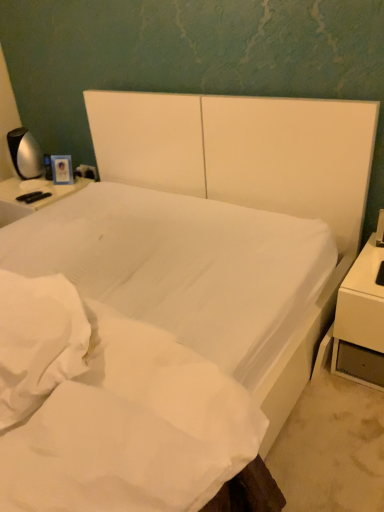
What do you see at coordinates (361, 319) in the screenshot?
I see `white glossy nightstand at right` at bounding box center [361, 319].

The height and width of the screenshot is (512, 384). I want to click on white smooth mattress at center, so click(x=110, y=408).

Where is `nightstand located behind the white smooth mattress at center`? nightstand located behind the white smooth mattress at center is located at coordinates (361, 319).

Consider the image. Looking at their sizes, would you say white glossy nightstand at right is wider or thinner than white smooth mattress at center?

In the image, white glossy nightstand at right appears to be more narrow than white smooth mattress at center.

Considering the positions of point (340, 315) and point (42, 374), is point (340, 315) closer or farther from the camera than point (42, 374)?

Point (340, 315) is positioned farther from the camera compared to point (42, 374).

From a real-world perspective, which is physically above, white glossy nightstand at right or white smooth mattress at center?

white smooth mattress at center.

Does white smooth mattress at center have a larger size compared to white glossy nightstand at right?

Indeed, white smooth mattress at center has a larger size compared to white glossy nightstand at right.

From the picture: Can white glossy nightstand at right be found inside white smooth mattress at center?

Definitely not — white glossy nightstand at right is not inside white smooth mattress at center.

From the image's perspective, which object appears higher, white smooth mattress at center or white glossy nightstand at right?

white glossy nightstand at right appears higher in the image.

Locate an element on the screen. Image resolution: width=384 pixels, height=512 pixels. mattress in front of the white glossy nightstand at right is located at coordinates (110, 408).

Based on the photo, is satin silver lamp at left turned away from white glossy nightstand at right?

That's not correct — satin silver lamp at left is not looking away from white glossy nightstand at right.

From the image's perspective, is satin silver lamp at left located beneath white glossy nightstand at right?

No, from the image's perspective, satin silver lamp at left is not below white glossy nightstand at right.

Is there a large distance between satin silver lamp at left and white glossy nightstand at right?

Yes.

Considering the relative sizes of satin silver lamp at left and white glossy nightstand at right in the image provided, is satin silver lamp at left taller than white glossy nightstand at right?

Incorrect, the height of satin silver lamp at left is not larger of that of white glossy nightstand at right.

Is white glossy nightstand at right wider or thinner than satin silver lamp at left?

Considering their sizes, white glossy nightstand at right looks broader than satin silver lamp at left.

Image resolution: width=384 pixels, height=512 pixels. Identify the location of bedside lamp positioned vertically above the white glossy nightstand at right (from a real-world perspective). (25, 154).

Is white glossy nightstand at right inside the boundaries of satin silver lamp at left, or outside?

white glossy nightstand at right is not enclosed by satin silver lamp at left.

From the image's perspective, relative to satin silver lamp at left, is white glossy nightstand at right above or below?

From the image's perspective, white glossy nightstand at right appears below satin silver lamp at left.

Considering the sizes of objects white smooth mattress at center and satin silver lamp at left in the image provided, who is thinner, white smooth mattress at center or satin silver lamp at left?

With smaller width is satin silver lamp at left.

Which of these two, white smooth mattress at center or satin silver lamp at left, is bigger?

With larger size is white smooth mattress at center.

Does white smooth mattress at center touch satin silver lamp at left?

No, white smooth mattress at center is not in contact with satin silver lamp at left.

Considering the sizes of objects satin silver lamp at left and white smooth mattress at center in the image provided, who is wider, satin silver lamp at left or white smooth mattress at center?

Wider between the two is white smooth mattress at center.

Would you consider satin silver lamp at left to be distant from white smooth mattress at center?

That's right, there is a large distance between satin silver lamp at left and white smooth mattress at center.

Image resolution: width=384 pixels, height=512 pixels. Identify the location of bedside lamp behind the white smooth mattress at center. (25, 154).

Is satin silver lamp at left to the left or to the right of white smooth mattress at center in the image?

From the image, it's evident that satin silver lamp at left is to the left of white smooth mattress at center.

Where is `mattress in front of the white glossy nightstand at right`? mattress in front of the white glossy nightstand at right is located at coordinates (110, 408).

The height and width of the screenshot is (512, 384). In order to click on nightstand above the white smooth mattress at center (from the image's perspective) in this screenshot , I will do `click(361, 319)`.

Considering their positions, is white smooth mattress at center positioned further to satin silver lamp at left than white glossy nightstand at right?

white glossy nightstand at right is further to satin silver lamp at left.

From the image, which object appears to be nearer to white glossy nightstand at right, satin silver lamp at left or white smooth mattress at center?

white smooth mattress at center is positioned closer to the anchor white glossy nightstand at right.

When comparing their distances from white smooth mattress at center, does satin silver lamp at left or white glossy nightstand at right seem further?

Among the two, satin silver lamp at left is located further to white smooth mattress at center.

Considering their positions, is white glossy nightstand at right positioned closer to white smooth mattress at center than satin silver lamp at left?

Based on the image, white glossy nightstand at right appears to be nearer to white smooth mattress at center.

When comparing their distances from satin silver lamp at left, does white glossy nightstand at right or white smooth mattress at center seem further?

white glossy nightstand at right.

Estimate the real-world distances between objects in this image. Which object is further from white glossy nightstand at right, white smooth mattress at center or satin silver lamp at left?

satin silver lamp at left lies further to white glossy nightstand at right than the other object.

Image resolution: width=384 pixels, height=512 pixels. I want to click on nightstand between white smooth mattress at center and satin silver lamp at left in the front-back direction, so click(361, 319).